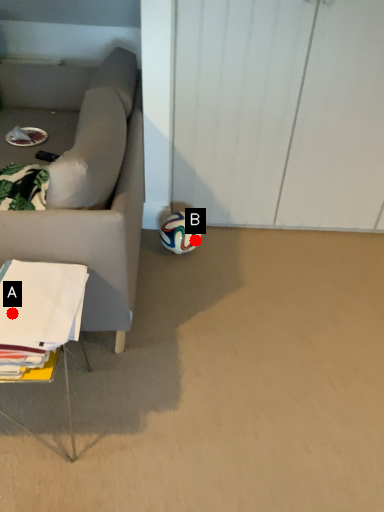
Question: Two points are circled on the image, labeled by A and B beside each circle. Which point is closer to the camera?

Choices:
 (A) A is closer
 (B) B is closer

Answer: (A)